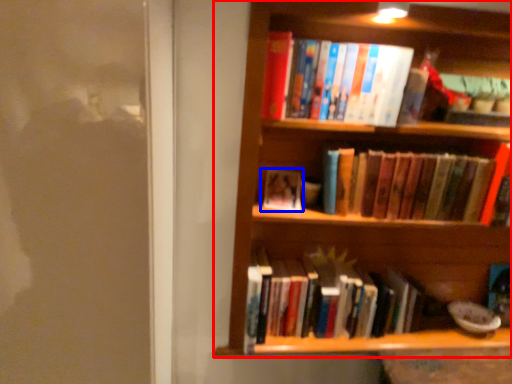
Question: Which object is further to the camera taking this photo, shelf (highlighted by a red box) or book (highlighted by a blue box)?

Choices:
 (A) shelf
 (B) book

Answer: (B)